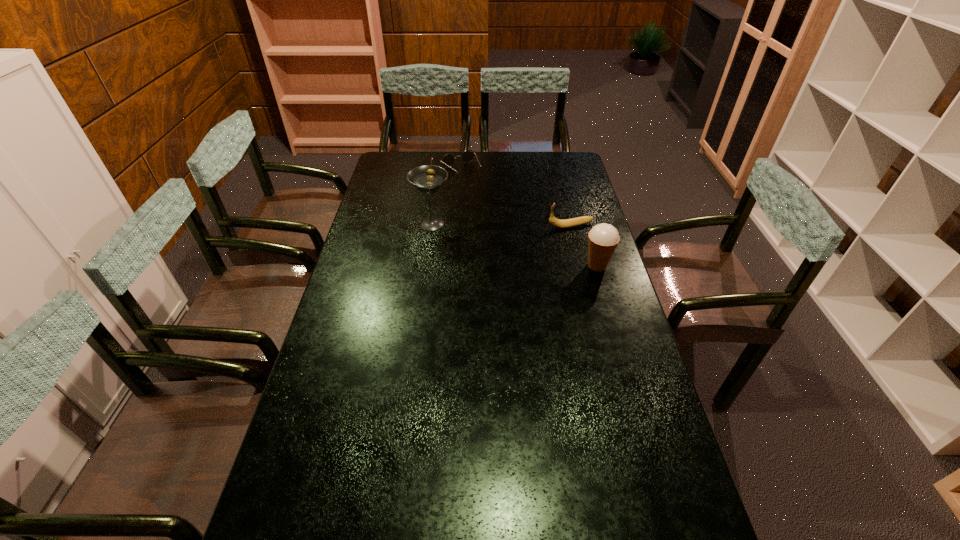
Where is `vacant space at the right edge of the desktop`? vacant space at the right edge of the desktop is located at coordinates (636, 382).

Where is `vacant space in between the shortest object and the icecream`? This screenshot has height=540, width=960. vacant space in between the shortest object and the icecream is located at coordinates (529, 218).

Where is `free space between the martini and the farthest object`? free space between the martini and the farthest object is located at coordinates (446, 197).

The image size is (960, 540). In order to click on free space between the farthest object and the nearest object in this screenshot , I will do `click(529, 218)`.

Locate an element on the screen. free space between the banana and the martini is located at coordinates (501, 225).

You are a GUI agent. You are given a task and a screenshot of the screen. Output one action in this format:
    pyautogui.click(x=<x>, y=<y>)
    Task: Click on the free space between the third tallest object and the second tallest object
    The height and width of the screenshot is (540, 960).
    Given the screenshot: What is the action you would take?
    pyautogui.click(x=584, y=246)

Image resolution: width=960 pixels, height=540 pixels. I want to click on vacant area between the farthest object and the second shortest object, so click(516, 198).

The height and width of the screenshot is (540, 960). Identify the location of free area in between the martini and the icecream. pos(515,245).

This screenshot has height=540, width=960. In order to click on vacant space in between the third tallest object and the shortest object in this screenshot , I will do `click(516, 198)`.

Identify the location of free space that is in between the icecream and the banana. Image resolution: width=960 pixels, height=540 pixels. (584, 246).